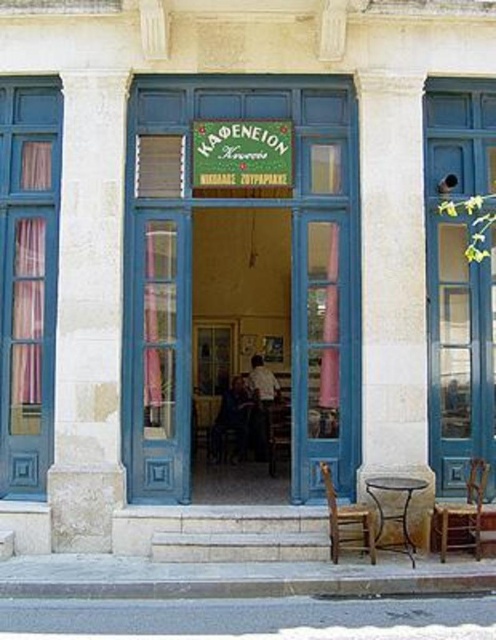
Question: Which point is farther to the camera?

Choices:
 (A) blue painted wood window at right
 (B) white stone pillar at right
 (C) white stone pillar at left

Answer: (A)

Question: Which of these objects is positioned closest to the white stone pillar at left?

Choices:
 (A) blue painted wood window at right
 (B) blue painted wood window at left

Answer: (B)

Question: Observing the image, what is the correct spatial positioning of blue painted wood window at right in reference to metallic brown stool at lower right?

Choices:
 (A) above
 (B) below

Answer: (A)

Question: Which of the following is the farthest from the observer?

Choices:
 (A) blue painted wood window at left
 (B) white stone pillar at left
 (C) wooden chair at lower right
 (D) white stone pillar at right

Answer: (A)

Question: Does blue painted wood window at right have a greater width compared to metallic brown stool at lower right?

Choices:
 (A) no
 (B) yes

Answer: (B)

Question: Does blue painted wood window at right have a larger size compared to blue painted wood window at left?

Choices:
 (A) yes
 (B) no

Answer: (A)